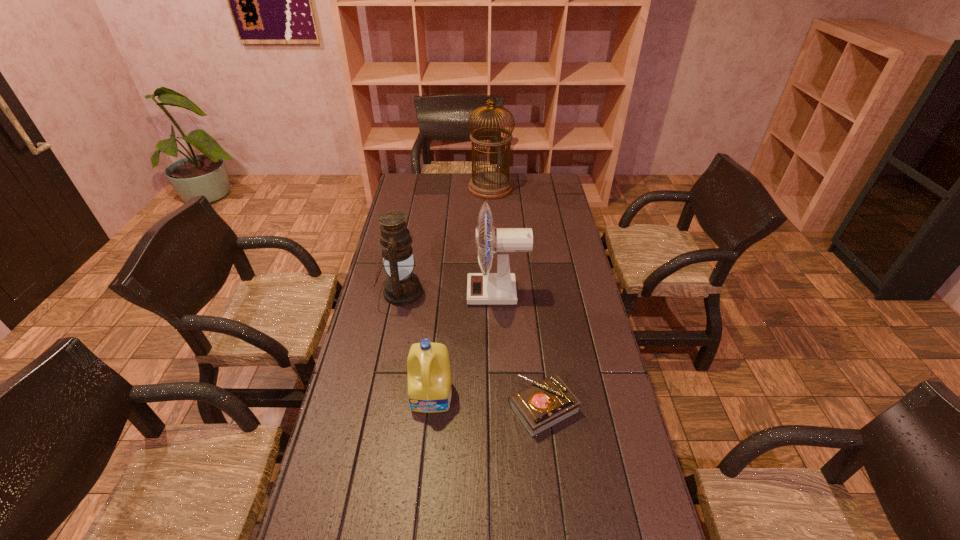
Locate an element on the screen. The width and height of the screenshot is (960, 540). free space located 0.100m on the front-facing side of the fan is located at coordinates (441, 293).

You are a GUI agent. You are given a task and a screenshot of the screen. Output one action in this format:
    pyautogui.click(x=<x>, y=<y>)
    Task: Click on the free space located 0.240m on the front-facing side of the fan
    The image size is (960, 540).
    Given the screenshot: What is the action you would take?
    (402, 293)

The height and width of the screenshot is (540, 960). I want to click on free spot located 0.170m on the front-facing side of the fan, so click(421, 293).

What are the coordinates of `vacant region located on the back of the leftmost object` in the screenshot? It's located at (407, 261).

This screenshot has width=960, height=540. Identify the location of vacant space situated 0.310m on the label of the fourth object from right to left. (420, 534).

The height and width of the screenshot is (540, 960). Identify the location of free space located 0.170m on the front of the shortest object. (555, 503).

Locate an element on the screen. Image resolution: width=960 pixels, height=540 pixels. object at the far edge is located at coordinates (487, 185).

Locate an element on the screen. The width and height of the screenshot is (960, 540). object located in the left edge section of the desktop is located at coordinates (402, 287).

Identify the location of object that is at the right edge. (544, 404).

Find the location of a particular element. The image size is (960, 540). blank space at the far edge of the desktop is located at coordinates (518, 193).